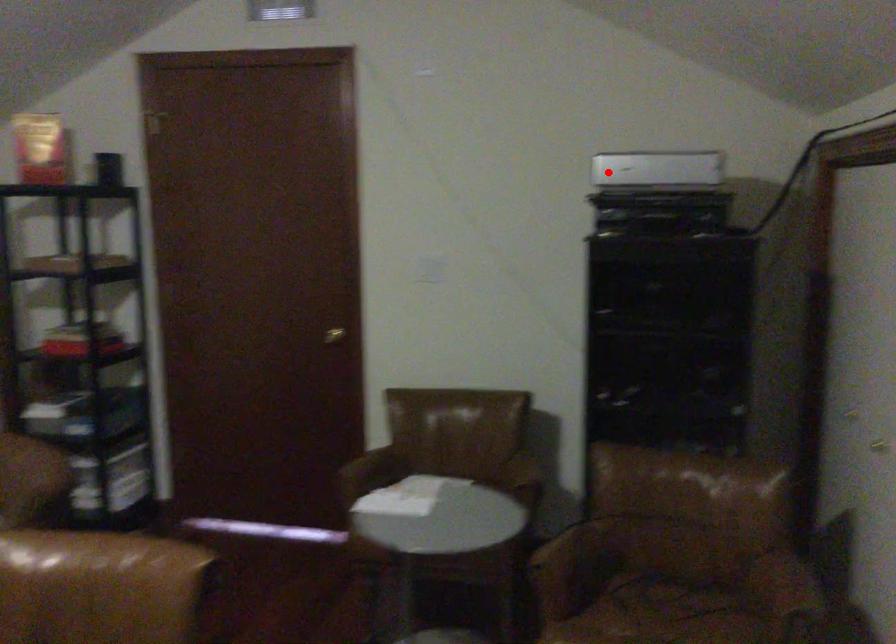
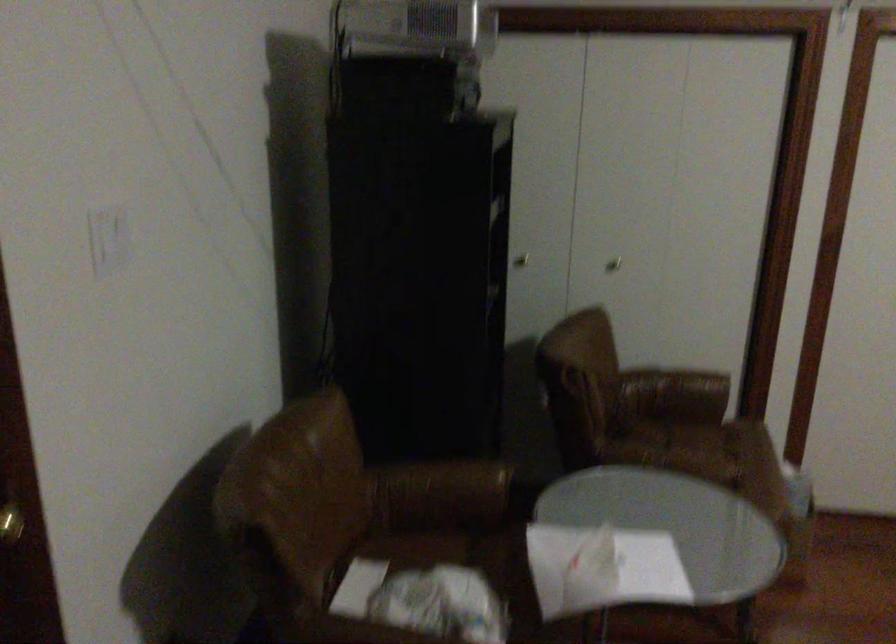
Locate, in the second image, the point that corresponds to the highlighted location in the first image.

(412, 26)